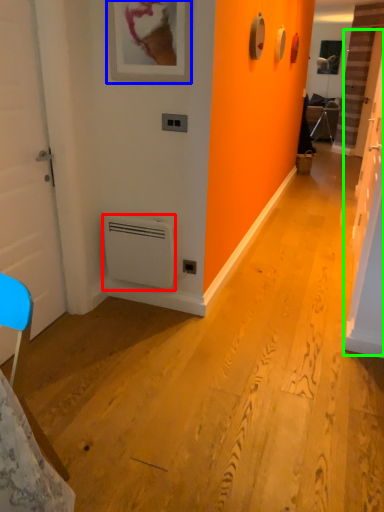
Question: Which object is the farthest from air conditioning (highlighted by a red box)? Choose among these: picture frame (highlighted by a blue box) or door (highlighted by a green box).

Choices:
 (A) picture frame
 (B) door

Answer: (B)